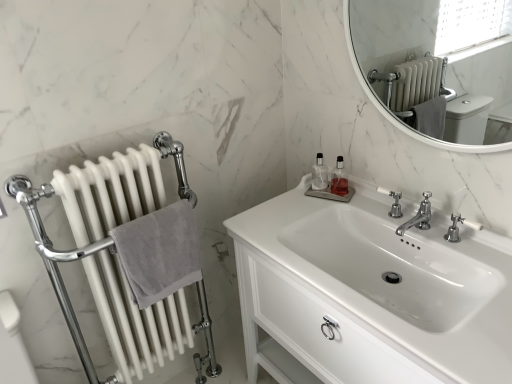
You are a GUI agent. You are given a task and a screenshot of the screen. Output one action in this format:
    pyautogui.click(x=<x>, y=<y>)
    Task: Click on the vacant area situated to the left side of clear glass bottle at upper center, the first toiletry when ordered from right to left
    
    Given the screenshot: What is the action you would take?
    pyautogui.click(x=297, y=204)